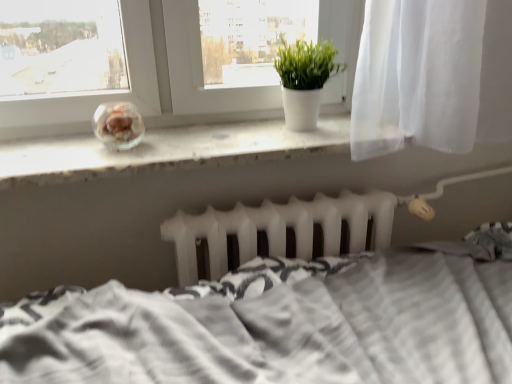
What are the coordinates of `free point in front of translucent glass jar at center` in the screenshot? It's located at (98, 158).